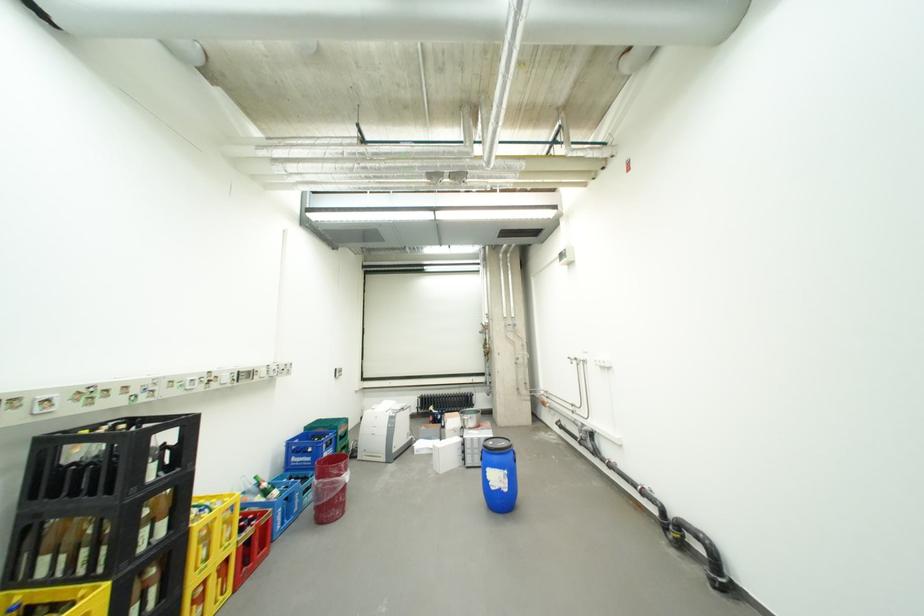
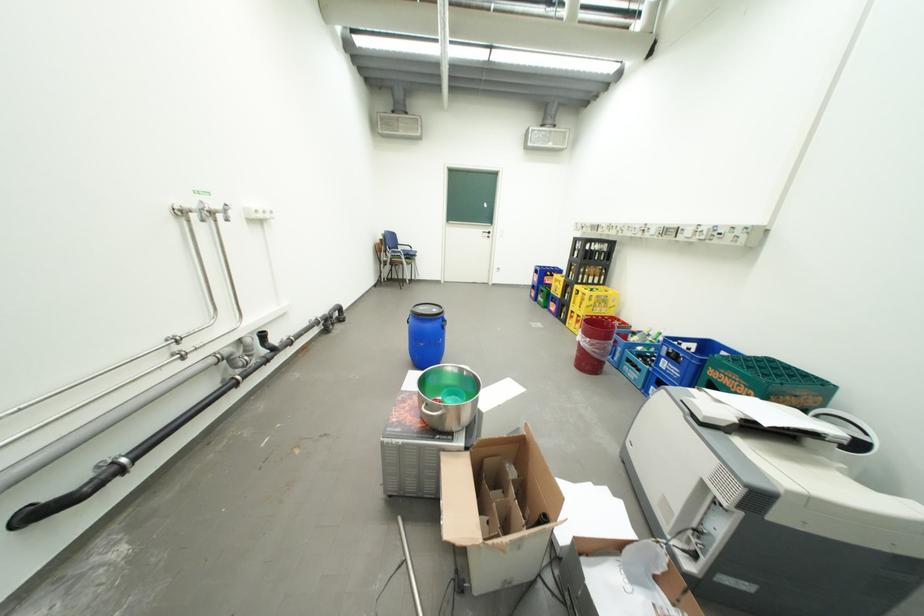
Where in the second image is the point corresponding to point (239, 546) from the first image?

(590, 312)